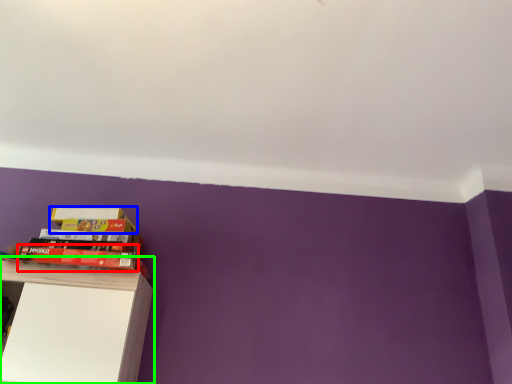
Question: Which object is the closest to the paperback book (highlighted by a red box)? Choose among these: paperback book (highlighted by a blue box) or shelf (highlighted by a green box).

Choices:
 (A) paperback book
 (B) shelf

Answer: (A)